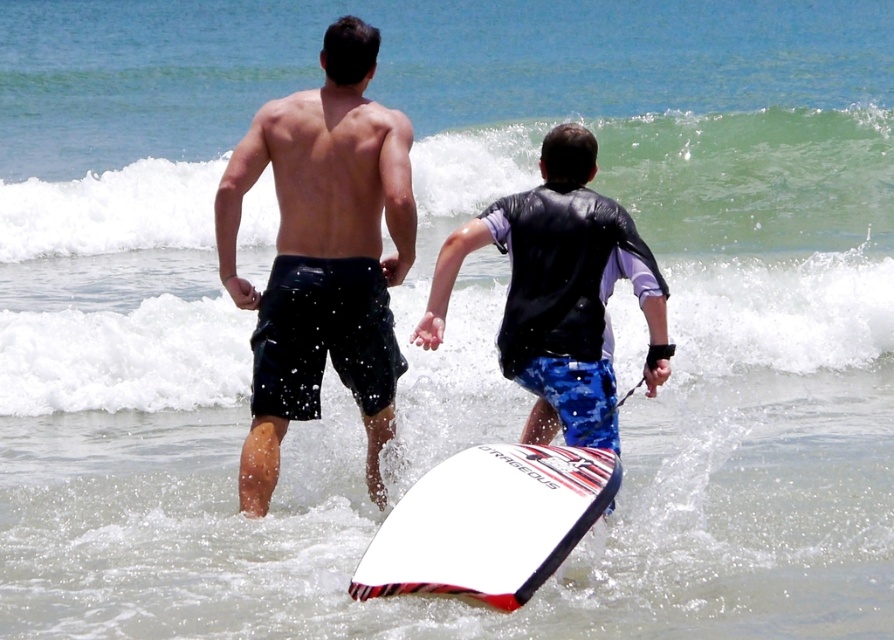
You are a photographer trying to capture a clear shot of both the black matte shorts at center and the white matte surfboard at center. Since both are at the same position, which one will appear larger in the photo?

The black matte shorts at center will appear larger in the photo because it is taller than the white matte surfboard at center.

You are a photographer trying to capture a clear shot of the black matte shorts at center and the green frothy wave at upper center. Which object should you focus on first to ensure it appears sharp in the photo?

The black matte shorts at center should be focused on first because it is behind the green frothy wave at upper center, so focusing on the closer object first ensures depth of field captures both.

You are a photographer trying to capture a photo of the black matte shorts at center and the white matte surfboard at center. If you want to make sure both objects are in focus, which one should you adjust your camera focus on first, the smaller or the larger object?

The black matte shorts at center is smaller than the white matte surfboard at center, so you should adjust your camera focus on the smaller object first to ensure both are in focus.